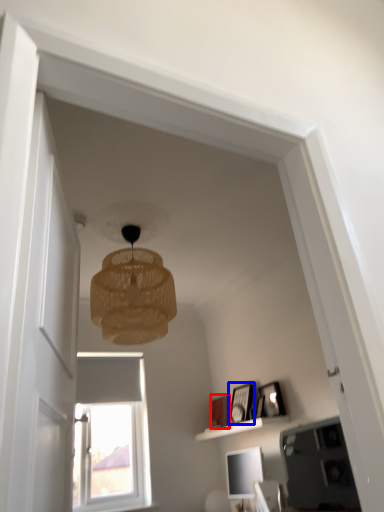
Question: Which point is closer to the camera, picture frame (highlighted by a red box) or picture frame (highlighted by a blue box)?

Choices:
 (A) picture frame
 (B) picture frame

Answer: (B)